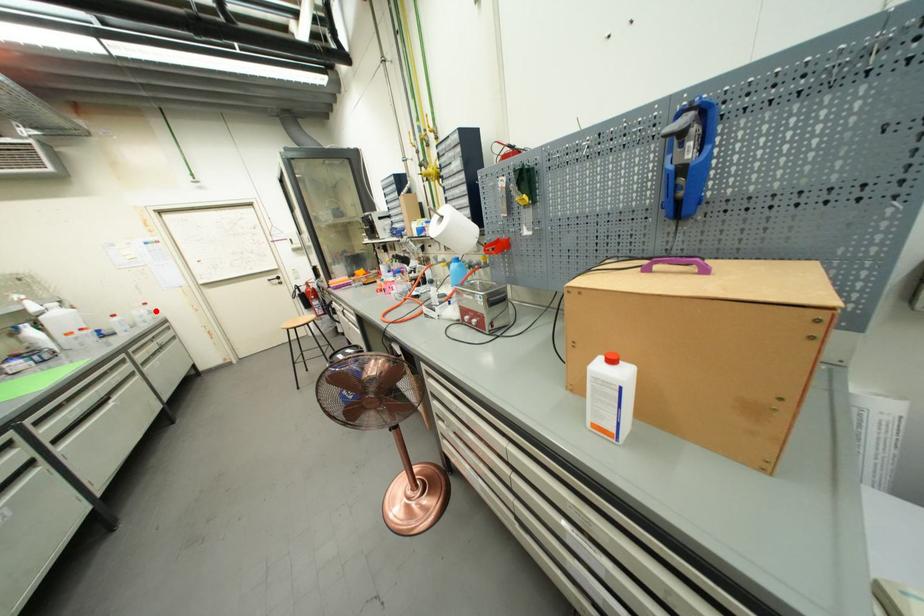
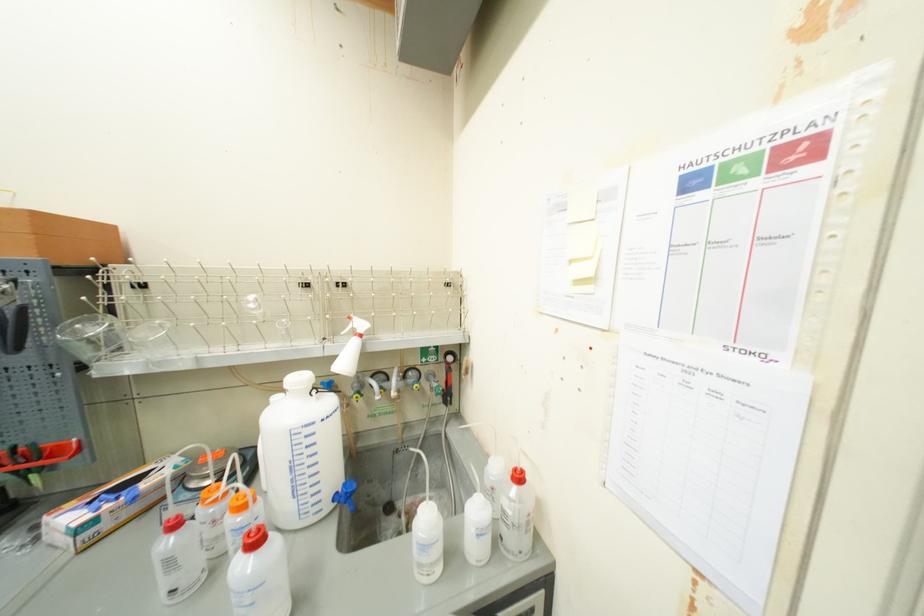
Where in the second image is the point corresponding to the highlighted location from the first image?

(515, 514)